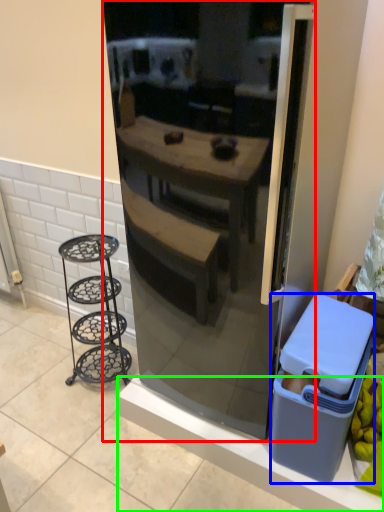
Question: Estimate the real-world distances between objects in this image. Which object is closer to refrigerator (highlighted by a red box), trash bin/can (highlighted by a blue box) or ledge (highlighted by a green box)?

Choices:
 (A) trash bin/can
 (B) ledge

Answer: (A)